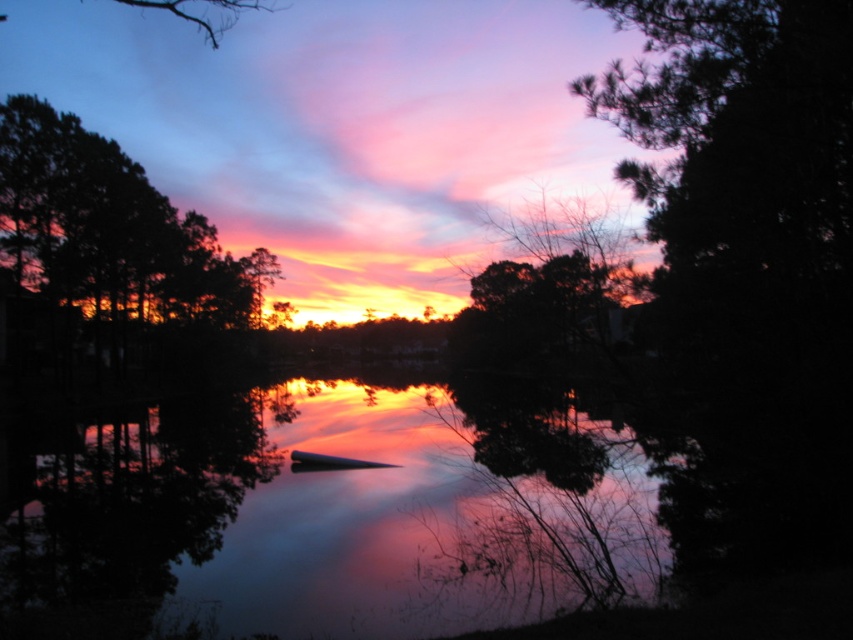
You are standing at the edge of the water and want to take a photo of the smooth water at center. Based on its position, where should you aim your camera to capture it?

The smooth water at center is located at point (326, 515), so you should aim your camera towards that coordinate to capture it.